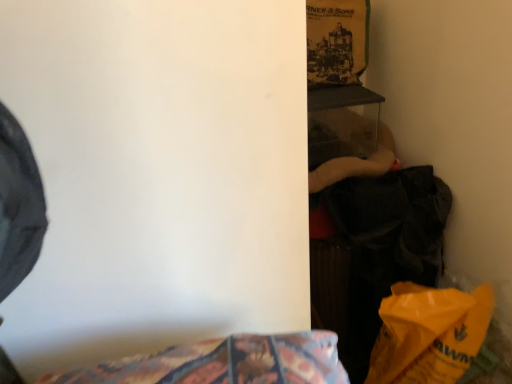
Question: From their relative heights in the image, would you say dark gray fabric at right is taller or shorter than yellow matte paper bag at lower right?

Choices:
 (A) short
 (B) tall

Answer: (B)

Question: Is dark gray fabric at right to the left or to the right of yellow matte paper bag at lower right in the image?

Choices:
 (A) right
 (B) left

Answer: (B)

Question: Is point [342, 271] positioned closer to the camera than point [371, 365]?

Choices:
 (A) farther
 (B) closer

Answer: (A)

Question: Based on their positions, is yellow matte paper bag at lower right located to the left or right of dark gray fabric at right?

Choices:
 (A) right
 (B) left

Answer: (A)

Question: From the image's perspective, is yellow matte paper bag at lower right located above or below dark gray fabric at right?

Choices:
 (A) above
 (B) below

Answer: (B)

Question: Is point (393, 289) positioned closer to the camera than point (340, 182)?

Choices:
 (A) closer
 (B) farther

Answer: (A)

Question: Is yellow matte paper bag at lower right taller or shorter than dark gray fabric at right?

Choices:
 (A) short
 (B) tall

Answer: (A)